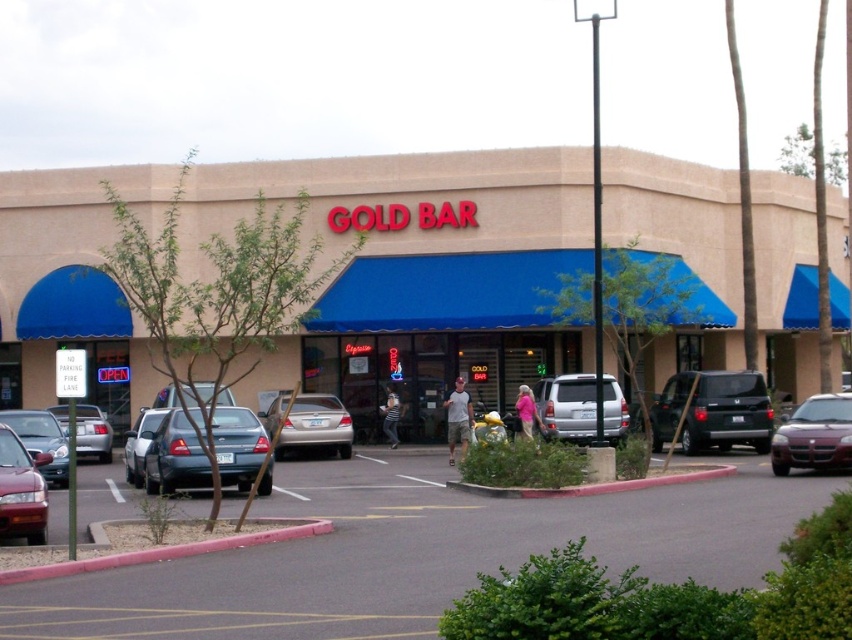
Does matte silver sedan at lower left lie in front of silver metallic sedan at left?

No, matte silver sedan at lower left is behind silver metallic sedan at left.

Does matte silver sedan at lower left come behind silver metallic sedan at left?

Yes, it is.

Which is in front, point (56, 433) or point (106, 422)?

Positioned in front is point (56, 433).

The height and width of the screenshot is (640, 852). Find the location of `matte silver sedan at lower left`. matte silver sedan at lower left is located at coordinates [x=41, y=440].

Which is above, blue awning at center or matte red car at lower left?

Positioned higher is blue awning at center.

Consider the image. Is blue awning at center smaller than matte red car at lower left?

Actually, blue awning at center might be larger than matte red car at lower left.

Is point (665, 228) more distant than point (7, 538)?

Yes.

This screenshot has height=640, width=852. In order to click on blue awning at center in this screenshot , I will do `click(422, 269)`.

Does point (663, 400) come closer to viewer compared to point (847, 448)?

That is False.

Find the location of `dark gray matte suv at right`. dark gray matte suv at right is located at coordinates (712, 412).